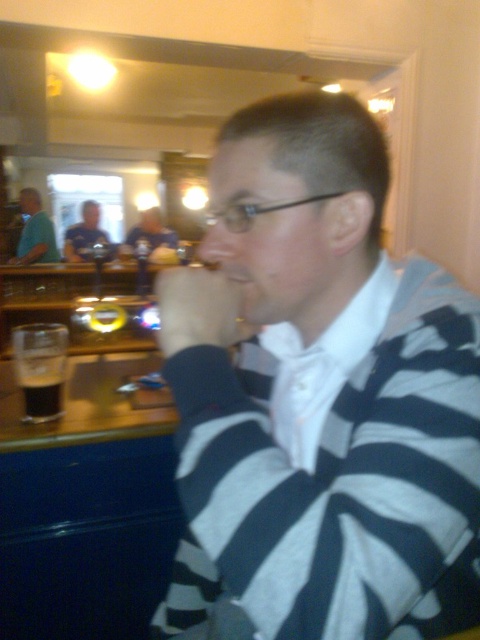
This screenshot has width=480, height=640. Identify the location of dark matte glass at lower left. click(x=40, y=369).

Can you confirm if dark matte glass at lower left is bigger than dark brown liquid at lower left?

Yes, dark matte glass at lower left is bigger than dark brown liquid at lower left.

Find the location of a particular element. This screenshot has height=640, width=480. dark matte glass at lower left is located at coordinates (40, 369).

Who is lower down, white striped shirt at center or matte black shirt at center?

Positioned lower is white striped shirt at center.

Does point (369, 296) come behind point (84, 234)?

No.

What do you see at coordinates (315, 364) in the screenshot? This screenshot has height=640, width=480. I see `white striped shirt at center` at bounding box center [315, 364].

Identify the location of white striped shirt at center. (315, 364).

The width and height of the screenshot is (480, 640). Describe the element at coordinates (319, 396) in the screenshot. I see `striped sweater at center` at that location.

Can you confirm if striped sweater at center is positioned below dark matte glass at lower left?

Yes.

What are the coordinates of `striped sweater at center` in the screenshot? It's located at (319, 396).

This screenshot has width=480, height=640. Identify the location of striped sweater at center. (319, 396).